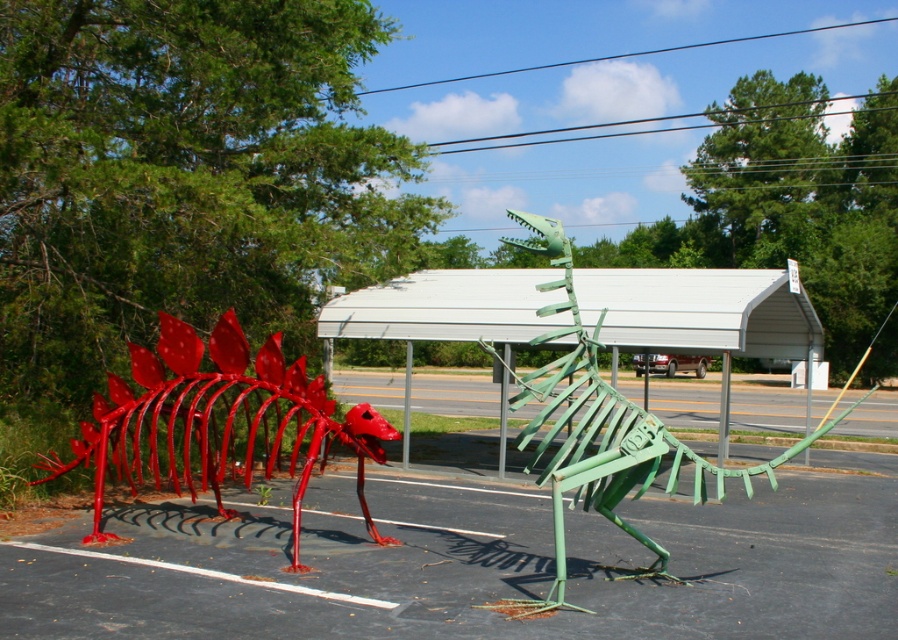
Can you confirm if metallic red dinosaur at left is positioned above green metallic dinosaur at center?

Correct, metallic red dinosaur at left is located above green metallic dinosaur at center.

Who is shorter, metallic red dinosaur at left or green metallic dinosaur at center?

Standing shorter between the two is metallic red dinosaur at left.

Measure the distance between metallic red dinosaur at left and camera.

A distance of 6.71 meters exists between metallic red dinosaur at left and camera.

Where is `metallic red dinosaur at left`? metallic red dinosaur at left is located at coordinates (216, 420).